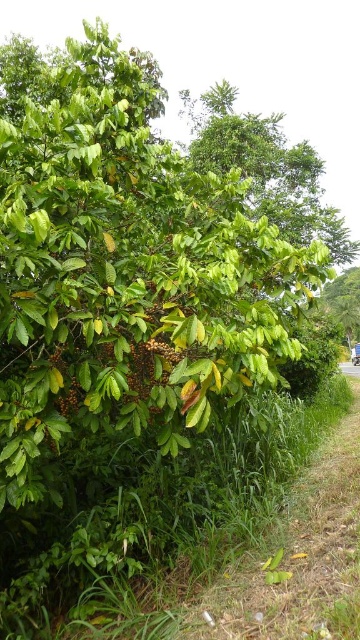
You are standing at the point marked by the coordinate point at point (266, 168). Looking around, you see the green leafy tree at upper center. Can you describe the direction of the tree relative to your position?

The green leafy tree at upper center is located directly at your current position since the point (266, 168) represents the tree itself.

You are a hiker who wants to take a photo of the green leafy tree at upper center from the gravel path at lower right. Considering the height difference between them, will you need to look up or down to frame the tree properly?

The green leafy tree at upper center is taller than the gravel path at lower right, so you will need to look up to frame the tree properly.